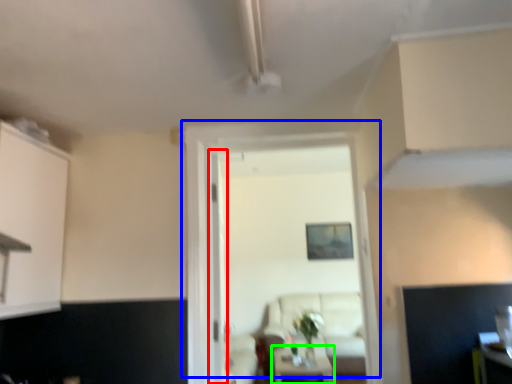
Question: Which is nearer to the glass door (highlighted by a red box)? door (highlighted by a blue box) or table (highlighted by a green box).

Choices:
 (A) door
 (B) table

Answer: (A)